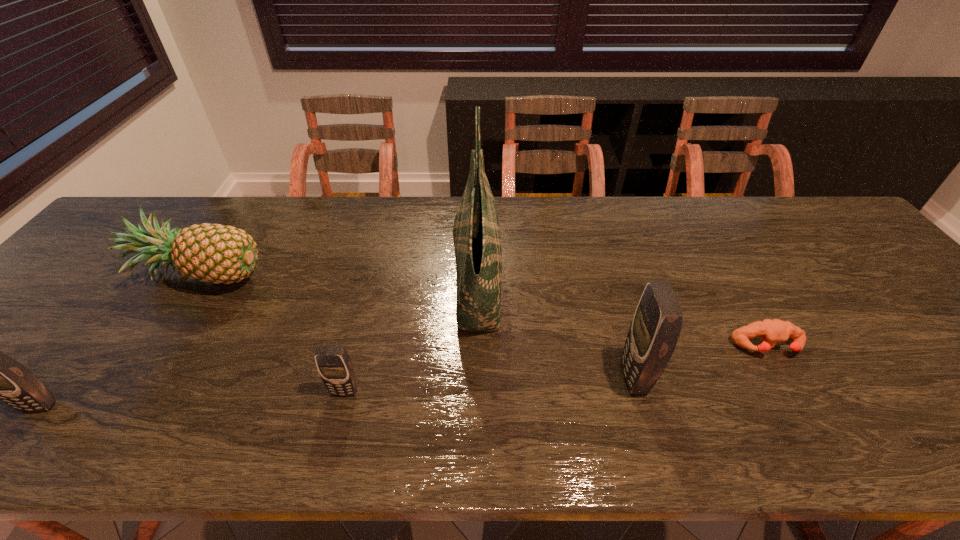
What are the coordinates of `vacant region located 0.350m on the front face of the second object from right to left` in the screenshot? It's located at click(461, 378).

You are a GUI agent. You are given a task and a screenshot of the screen. Output one action in this format:
    pyautogui.click(x=<x>, y=<y>)
    Task: Click on the vacant space located on the front face of the second object from right to left
    The width and height of the screenshot is (960, 540).
    Given the screenshot: What is the action you would take?
    pyautogui.click(x=516, y=378)

This screenshot has height=540, width=960. I want to click on vacant space located on the front face of the second object from right to left, so click(x=589, y=378).

Where is `free space located 0.240m on the right of the pineapple`? free space located 0.240m on the right of the pineapple is located at coordinates (359, 272).

Where is `vacant area situated 0.150m on the right of the tote bag`? This screenshot has height=540, width=960. vacant area situated 0.150m on the right of the tote bag is located at coordinates (557, 280).

Where is `object at the far edge`? This screenshot has width=960, height=540. object at the far edge is located at coordinates (477, 242).

In the image, there is a desktop. Find the location of `vacant area at the far edge`. vacant area at the far edge is located at coordinates (607, 195).

Where is `blank space at the near edge of the desktop`? This screenshot has width=960, height=540. blank space at the near edge of the desktop is located at coordinates (99, 372).

Locate an element on the screen. vacant space at the left edge is located at coordinates (86, 260).

In the image, there is a desktop. Identify the location of vacant space at the right edge. This screenshot has height=540, width=960. (897, 288).